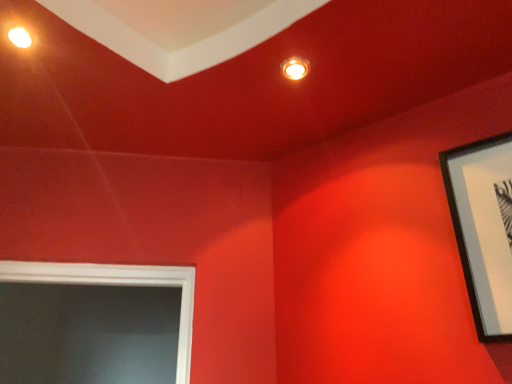
Question: From a real-world perspective, is matte orange light fixture at upper center above or below black matte picture frame at upper right?

Choices:
 (A) above
 (B) below

Answer: (A)

Question: Is matte orange light fixture at upper center to the left or to the right of black matte picture frame at upper right in the image?

Choices:
 (A) right
 (B) left

Answer: (B)

Question: From the image's perspective, is matte orange light fixture at upper center positioned above or below black matte picture frame at upper right?

Choices:
 (A) below
 (B) above

Answer: (B)

Question: From a real-world perspective, is black matte picture frame at upper right positioned above or below matte orange light fixture at upper center?

Choices:
 (A) below
 (B) above

Answer: (A)

Question: Considering the positions of point (456, 157) and point (300, 62), is point (456, 157) closer or farther from the camera than point (300, 62)?

Choices:
 (A) closer
 (B) farther

Answer: (B)

Question: In terms of size, does black matte picture frame at upper right appear bigger or smaller than matte orange light fixture at upper center?

Choices:
 (A) small
 (B) big

Answer: (B)

Question: In terms of width, does black matte picture frame at upper right look wider or thinner when compared to matte orange light fixture at upper center?

Choices:
 (A) thin
 (B) wide

Answer: (A)